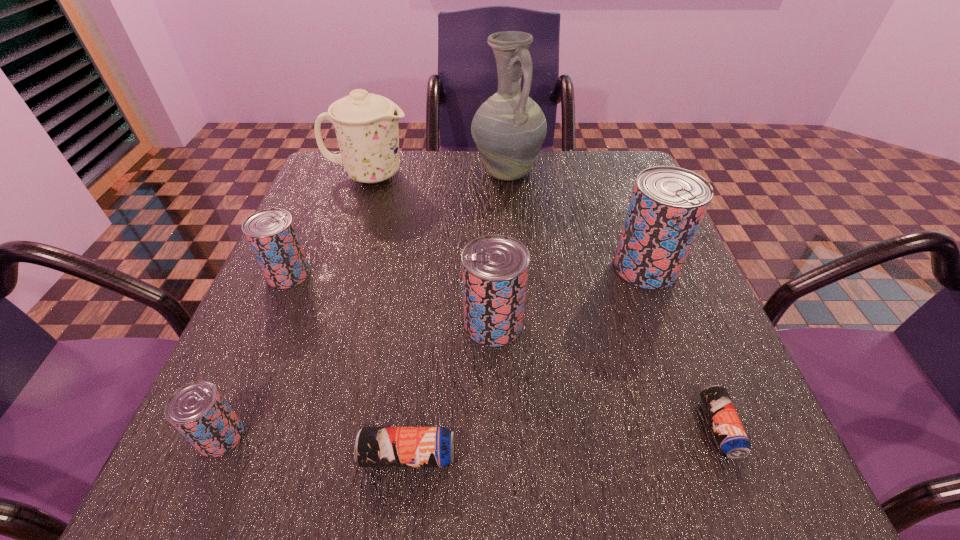
Locate an element on the screen. The image size is (960, 540). empty space that is in between the tallest beer can and the chinaware is located at coordinates (507, 221).

This screenshot has height=540, width=960. I want to click on blank region between the rightmost red beer can and the third beer can from left to right, so click(x=526, y=361).

Identify the location of unoccupied position between the sixth tallest object and the chinaware. (296, 306).

This screenshot has height=540, width=960. Find the location of `vacant region between the tallest beer can and the second biggest red beer can`. vacant region between the tallest beer can and the second biggest red beer can is located at coordinates (569, 295).

At what (x,y) coordinates should I click in order to perform the action: click on free area in between the fourth tallest object and the smallest red beer can. Please return your answer as a coordinate pair (x, y). Looking at the image, I should click on (357, 380).

The image size is (960, 540). Identify the location of the sixth closest object to the chinaware. (374, 446).

Identify which object is the fifth closest to the rightmost red beer can. Please provide its 2D coordinates. Your answer should be formatted as a tuple, i.e. [(x, y)], where the tuple contains the x and y coordinates of a point satisfying the conditions above.

[(366, 125)]

Point out which beer can is positioned as the second nearest to the pitcher. Please provide its 2D coordinates. Your answer should be formatted as a tuple, i.e. [(x, y)], where the tuple contains the x and y coordinates of a point satisfying the conditions above.

[(495, 268)]

Select which beer can is the third closest to the rightmost red beer can. Please provide its 2D coordinates. Your answer should be formatted as a tuple, i.e. [(x, y)], where the tuple contains the x and y coordinates of a point satisfying the conditions above.

[(374, 446)]

Select which red beer can appears as the closest to the second shortest object. Please provide its 2D coordinates. Your answer should be formatted as a tuple, i.e. [(x, y)], where the tuple contains the x and y coordinates of a point satisfying the conditions above.

[(495, 268)]